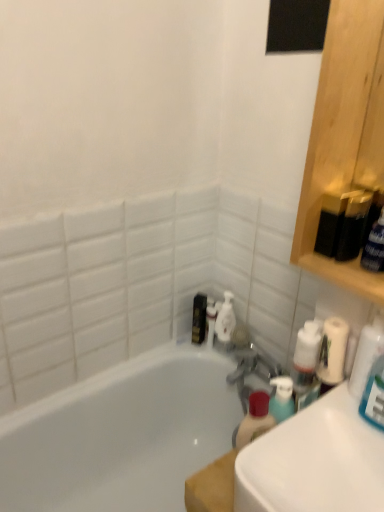
The height and width of the screenshot is (512, 384). In order to click on vacant space in front of metallic gold toiletry at center, which is counted as the first toiletry, starting from the left in this screenshot , I will do `click(208, 360)`.